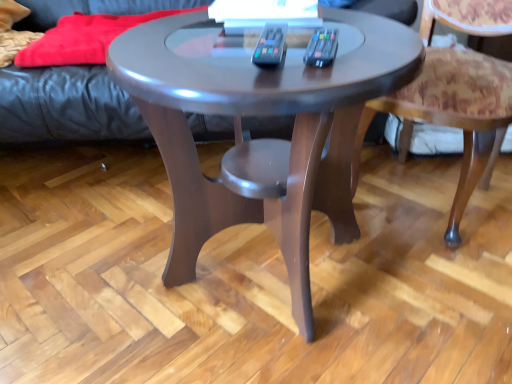
Question: Considering the relative sizes of glossy wood coffee table at center and patterned fabric chair at lower right in the image provided, is glossy wood coffee table at center smaller than patterned fabric chair at lower right?

Choices:
 (A) yes
 (B) no

Answer: (B)

Question: Does glossy wood coffee table at center have a greater height compared to patterned fabric chair at lower right?

Choices:
 (A) no
 (B) yes

Answer: (A)

Question: Can you confirm if glossy wood coffee table at center is shorter than patterned fabric chair at lower right?

Choices:
 (A) no
 (B) yes

Answer: (B)

Question: Considering the relative positions of glossy wood coffee table at center and patterned fabric chair at lower right in the image provided, is glossy wood coffee table at center to the left of patterned fabric chair at lower right from the viewer's perspective?

Choices:
 (A) yes
 (B) no

Answer: (A)

Question: Is patterned fabric chair at lower right a part of glossy wood coffee table at center?

Choices:
 (A) yes
 (B) no

Answer: (B)

Question: Is glossy wood coffee table at center to the left or to the right of patterned fabric chair at lower right in the image?

Choices:
 (A) right
 (B) left

Answer: (B)

Question: Considering the positions of glossy wood coffee table at center and patterned fabric chair at lower right in the image, is glossy wood coffee table at center bigger or smaller than patterned fabric chair at lower right?

Choices:
 (A) small
 (B) big

Answer: (B)

Question: Is glossy wood coffee table at center wider or thinner than patterned fabric chair at lower right?

Choices:
 (A) thin
 (B) wide

Answer: (B)

Question: Does point (347, 46) appear closer or farther from the camera than point (481, 145)?

Choices:
 (A) closer
 (B) farther

Answer: (B)

Question: Considering the positions of leather couch at upper left and glossy wood coffee table at center in the image, is leather couch at upper left bigger or smaller than glossy wood coffee table at center?

Choices:
 (A) small
 (B) big

Answer: (B)

Question: Is leather couch at upper left inside the boundaries of glossy wood coffee table at center, or outside?

Choices:
 (A) outside
 (B) inside

Answer: (A)

Question: Considering their positions, is leather couch at upper left located in front of or behind glossy wood coffee table at center?

Choices:
 (A) behind
 (B) front

Answer: (A)

Question: Considering the positions of leather couch at upper left and glossy wood coffee table at center in the image, is leather couch at upper left taller or shorter than glossy wood coffee table at center?

Choices:
 (A) short
 (B) tall

Answer: (A)

Question: Looking at their shapes, would you say patterned fabric chair at lower right is wider or thinner than leather couch at upper left?

Choices:
 (A) wide
 (B) thin

Answer: (B)

Question: From a real-world perspective, relative to leather couch at upper left, is patterned fabric chair at lower right vertically above or below?

Choices:
 (A) above
 (B) below

Answer: (A)